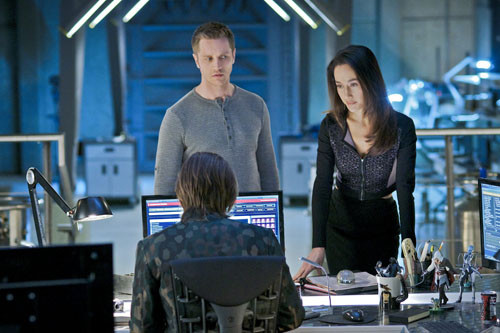
The width and height of the screenshot is (500, 333). What are the coordinates of `computer monitor` in the screenshot? It's located at (272, 208).